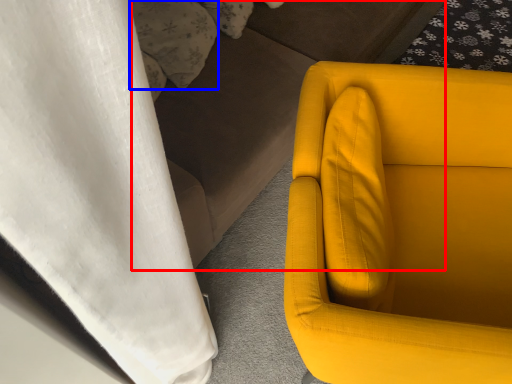
Question: Which object appears farthest to the camera in this image, couch (highlighted by a red box) or pillow (highlighted by a blue box)?

Choices:
 (A) couch
 (B) pillow

Answer: (B)